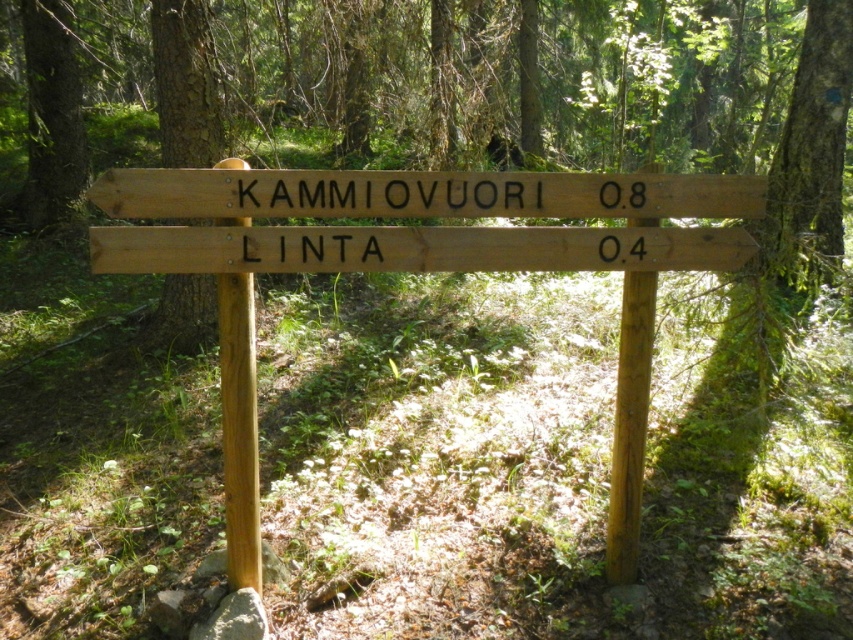
You are standing at the point labeled as point (419, 269) in the image. Based on the scene description, what object are you directly facing?

The point (419, 269) indicates wooden signpost at center, so you are directly facing the wooden signpost at center.

You are a hiker who just arrived at the wooden signpost at center. You notice a brown rough tree trunk at upper left in the background. Which object is closer to you?

The wooden signpost at center is closer to the viewer than the brown rough tree trunk at upper left.